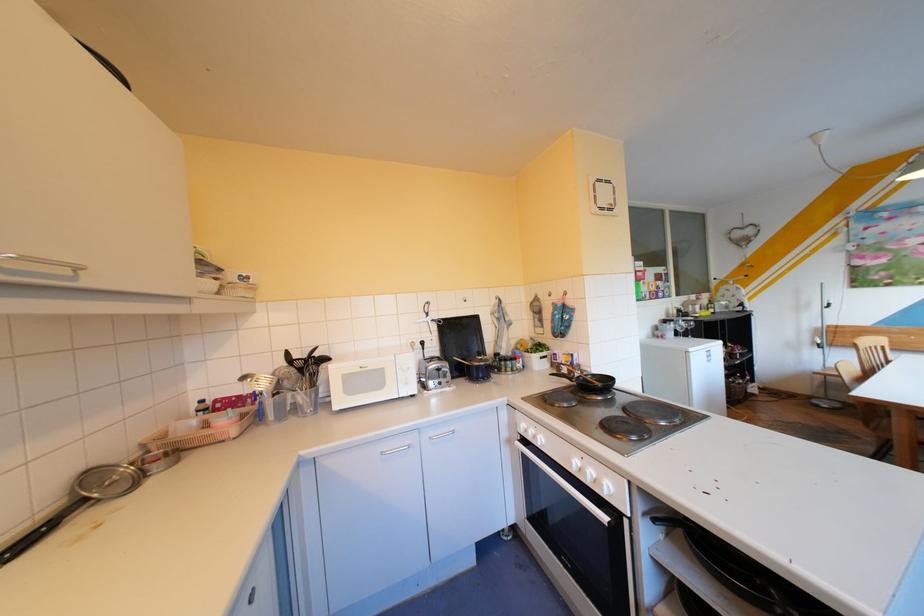
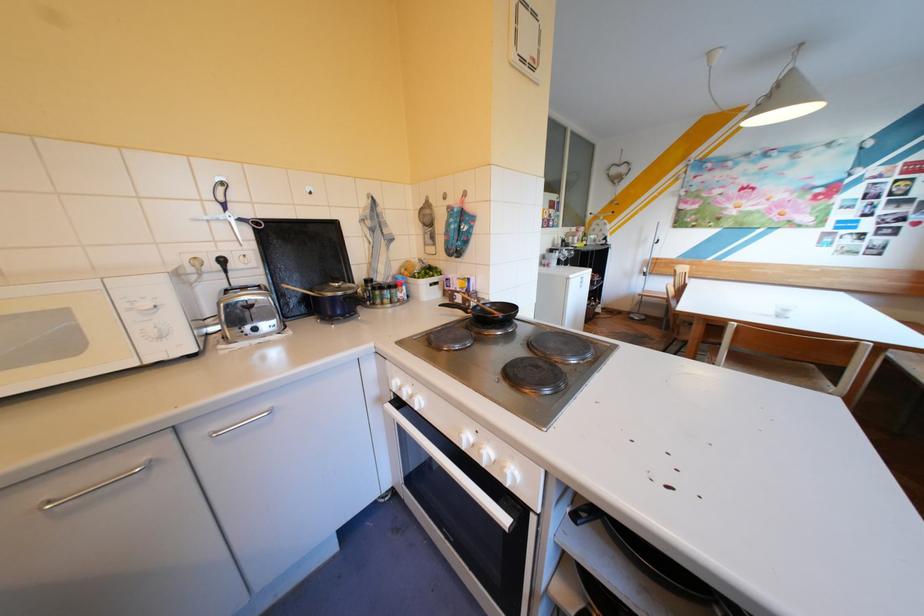
In the second image, find the point that corresponds to pixel 570 315 in the first image.

(466, 225)